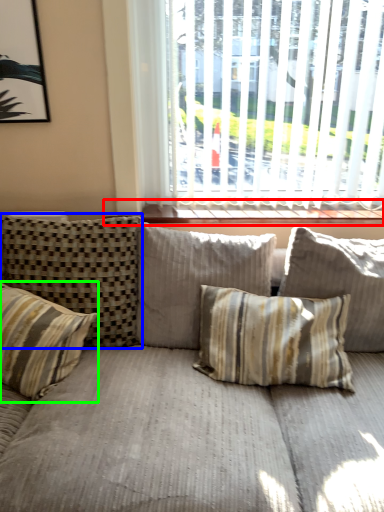
Question: Which object is the farthest from window sill (highlighted by a red box)? Choose among these: pillow (highlighted by a blue box) or pillow (highlighted by a green box).

Choices:
 (A) pillow
 (B) pillow

Answer: (B)